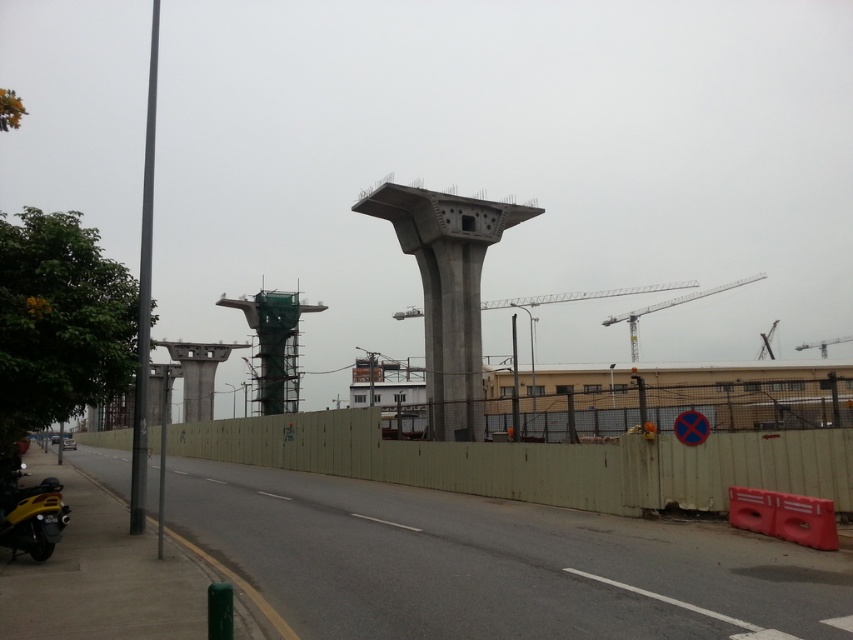
You are a delivery robot positioned at the center of the road. You need to navigate to the yellow matte motorcycle at lower left. Based on the coordinates provided, which direction should you turn first to reach it?

The yellow matte motorcycle at lower left is located at coordinates point (28, 512). Since the robot is at the center of the road, it should turn left to head towards the lower left direction where the motorcycle is positioned.

You are a drone operator trying to capture a photo of the construction site. The drone must stay within a 100m radius from the white metallic crane at upper center to avoid restricted airspace. If the drone is currently at point A located at coordinates 0.480, 0.785, is it within the allowed radius?

The white metallic crane at upper center is located at point [669,307]. Since the drone is at the same coordinates, it is exactly at the center of the restricted airspace and therefore within the 100m radius.